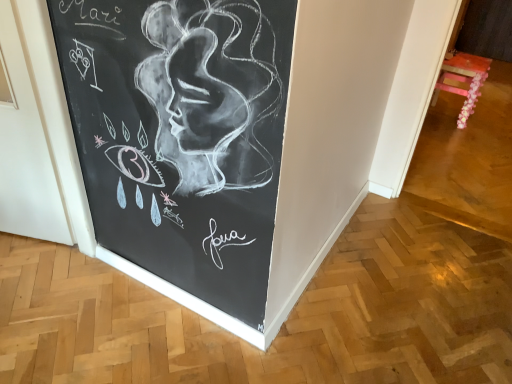
Identify the location of pink wood chair at right. The width and height of the screenshot is (512, 384). (463, 81).

Image resolution: width=512 pixels, height=384 pixels. What do you see at coordinates (463, 81) in the screenshot? I see `pink wood chair at right` at bounding box center [463, 81].

Identify the location of pink wood chair at right. This screenshot has width=512, height=384. (463, 81).